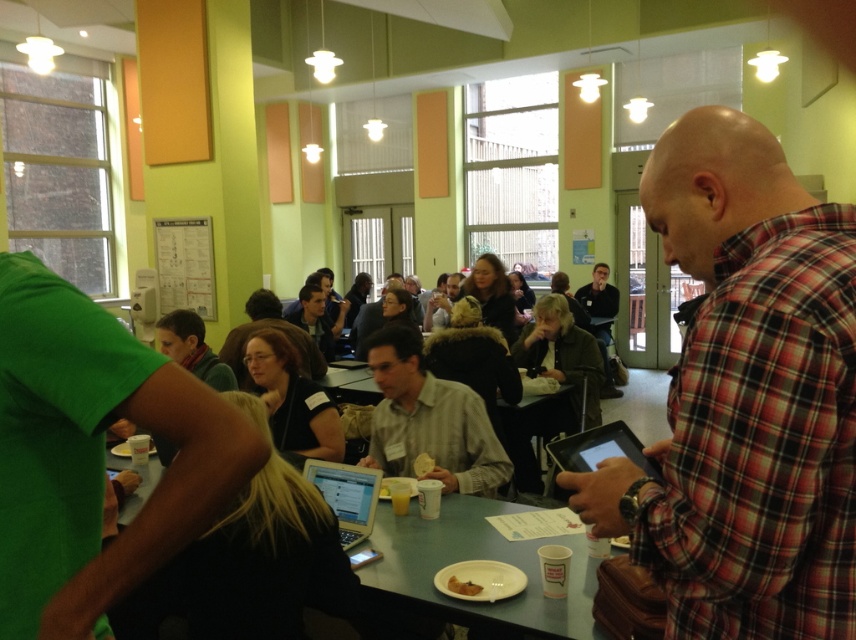
Between light brown plaid shirt at center and silver metallic laptop at center, which one is positioned higher?

light brown plaid shirt at center

Image resolution: width=856 pixels, height=640 pixels. In order to click on light brown plaid shirt at center in this screenshot , I will do `click(429, 420)`.

Who is lower down, green plastic table at center or yellow matte bread at center?

Positioned lower is green plastic table at center.

Does green plastic table at center appear on the left side of yellow matte bread at center?

Incorrect, green plastic table at center is not on the left side of yellow matte bread at center.

Who is more forward, (512, 548) or (432, 461)?

Point (512, 548)

Locate an element on the screen. Image resolution: width=856 pixels, height=640 pixels. green plastic table at center is located at coordinates (509, 561).

Who is taller, green fabric shirt at left or yellow matte bread at center?

green fabric shirt at left

Between green fabric shirt at left and yellow matte bread at center, which one has less height?

Standing shorter between the two is yellow matte bread at center.

This screenshot has width=856, height=640. I want to click on green fabric shirt at left, so click(93, 454).